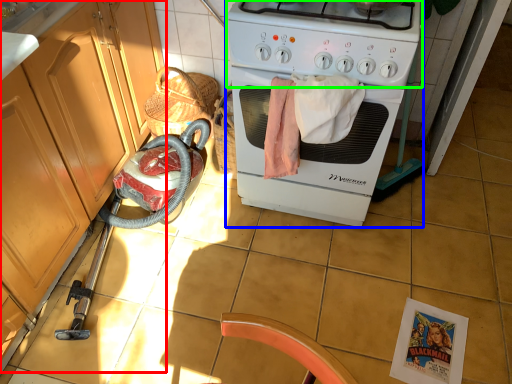
Question: Which object is the farthest from cabinetry (highlighted by a red box)? Choose among these: home appliance (highlighted by a blue box) or gas stove (highlighted by a green box).

Choices:
 (A) home appliance
 (B) gas stove

Answer: (B)